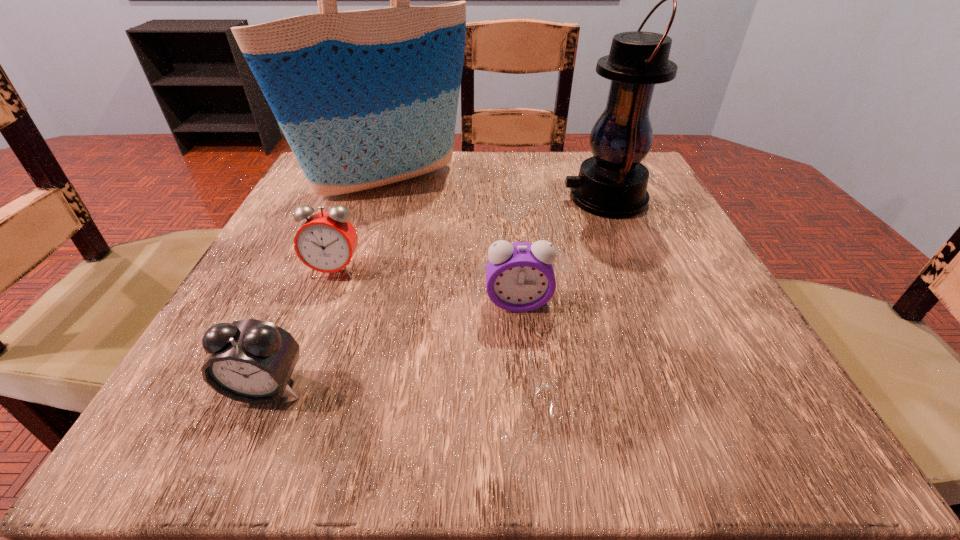
Identify which alarm clock is the second nearest to the lantern. Please provide its 2D coordinates. Your answer should be formatted as a tuple, i.e. [(x, y)], where the tuple contains the x and y coordinates of a point satisfying the conditions above.

[(326, 242)]

Find the location of a particular element. vacant space that satisfies the following two spatial constraints: 1. above the rightmost object, indicating its light source; 2. on the front side of the nearest object is located at coordinates (682, 388).

Find the location of a particular element. free space that satisfies the following two spatial constraints: 1. above the second tallest object, indicating its light source; 2. on the front side of the nearest alarm clock is located at coordinates (682, 388).

Locate an element on the screen. free spot that satisfies the following two spatial constraints: 1. above the second tallest object, indicating its light source; 2. on the front side of the nearest alarm clock is located at coordinates (682, 388).

I want to click on vacant space that satisfies the following two spatial constraints: 1. above the rightmost object, indicating its light source; 2. on the front-facing side of the third farthest object, so click(x=635, y=271).